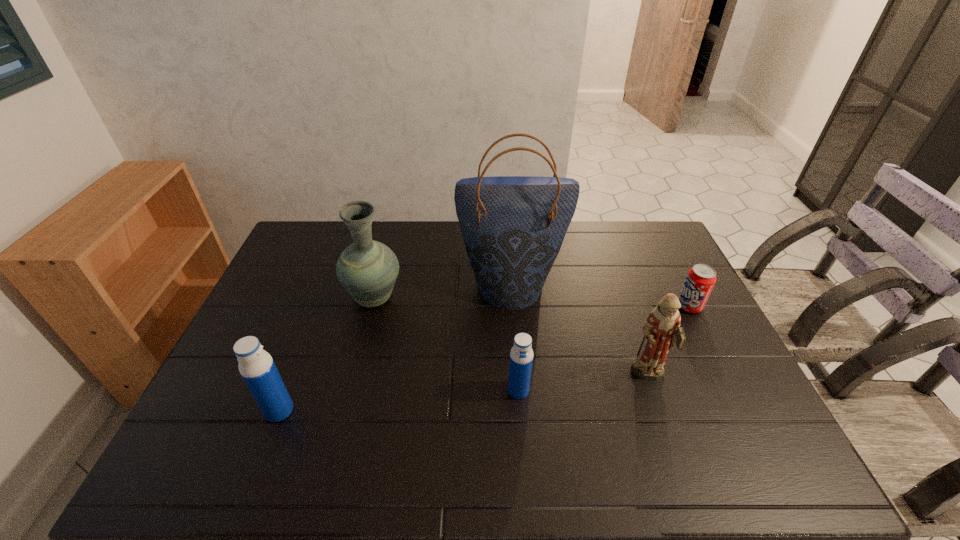
Where is `free space between the figurine and the pitcher`? free space between the figurine and the pitcher is located at coordinates (512, 338).

The image size is (960, 540). Find the location of `free space between the leftmost object and the shorter water bottle`. free space between the leftmost object and the shorter water bottle is located at coordinates (398, 401).

You are a GUI agent. You are given a task and a screenshot of the screen. Output one action in this format:
    pyautogui.click(x=<x>, y=<y>)
    Task: Click on the vacant space that's between the left water bottle and the tallest object
    The image size is (960, 540).
    Given the screenshot: What is the action you would take?
    pyautogui.click(x=396, y=348)

The width and height of the screenshot is (960, 540). What are the coordinates of `free space between the shopping bag and the left water bottle` in the screenshot? It's located at (396, 348).

Where is `free space between the shorter water bottle and the figurine`? Image resolution: width=960 pixels, height=540 pixels. free space between the shorter water bottle and the figurine is located at coordinates (584, 383).

I want to click on free space between the fifth tallest object and the soda can, so click(604, 348).

Where is `object that stands as the closest to the left water bottle`? object that stands as the closest to the left water bottle is located at coordinates pyautogui.click(x=367, y=269).

Identify which object is the fifth closest to the shopping bag. Please provide its 2D coordinates. Your answer should be formatted as a tuple, i.e. [(x, y)], where the tuple contains the x and y coordinates of a point satisfying the conditions above.

[(256, 366)]

The image size is (960, 540). Find the location of `free space that satisfies the following two spatial constraints: 1. on the surface of the soda can; 2. on the front-facing side of the figurine`. free space that satisfies the following two spatial constraints: 1. on the surface of the soda can; 2. on the front-facing side of the figurine is located at coordinates [725, 376].

Where is `free location that satisfies the following two spatial constraints: 1. on the handle side of the shopping bag; 2. on the left side of the pitcher`? free location that satisfies the following two spatial constraints: 1. on the handle side of the shopping bag; 2. on the left side of the pitcher is located at coordinates (377, 286).